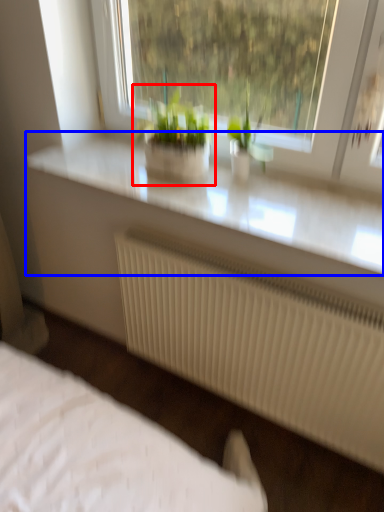
Question: Which object is closer to the camera taking this photo, houseplant (highlighted by a red box) or counter top (highlighted by a blue box)?

Choices:
 (A) houseplant
 (B) counter top

Answer: (B)